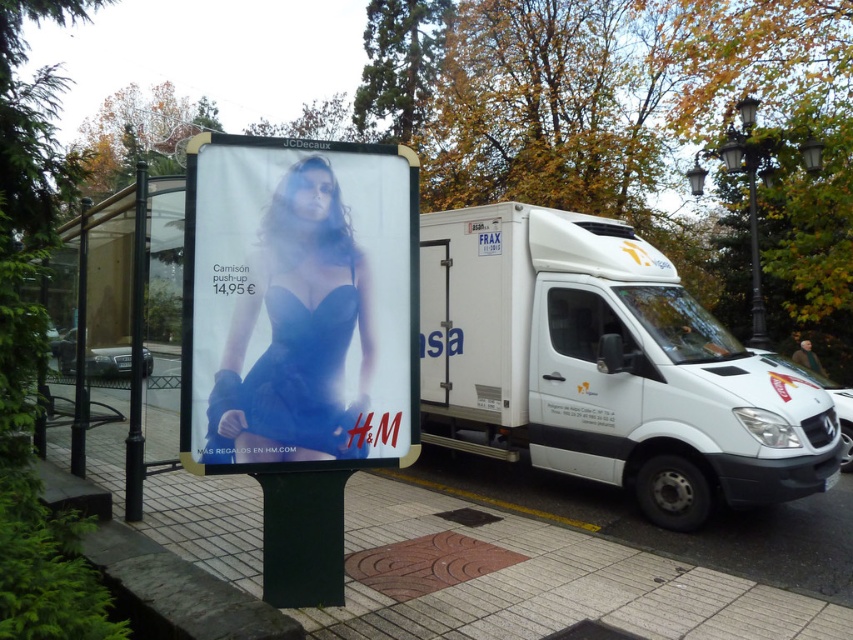
Is white matte van at center shorter than black metal pole at left?

No.

Does white matte van at center have a smaller size compared to black metal pole at left?

Incorrect, white matte van at center is not smaller in size than black metal pole at left.

The image size is (853, 640). Find the location of `white matte van at center`. white matte van at center is located at coordinates (605, 368).

The height and width of the screenshot is (640, 853). What do you see at coordinates (605, 368) in the screenshot? I see `white matte van at center` at bounding box center [605, 368].

Does point (674, 333) come closer to viewer compared to point (846, 506)?

That is True.

I want to click on white matte van at center, so [605, 368].

Locate an element on the screen. white matte van at center is located at coordinates point(605,368).

Which is behind, point (180, 445) or point (497, 544)?

Positioned behind is point (497, 544).

Does point (198, 369) come farther from viewer compared to point (349, 637)?

That is False.

At what (x,y) coordinates should I click in order to perform the action: click on matte blue lingerie at center. Please return your answer as a coordinate pair (x, y). Looking at the image, I should click on (299, 304).